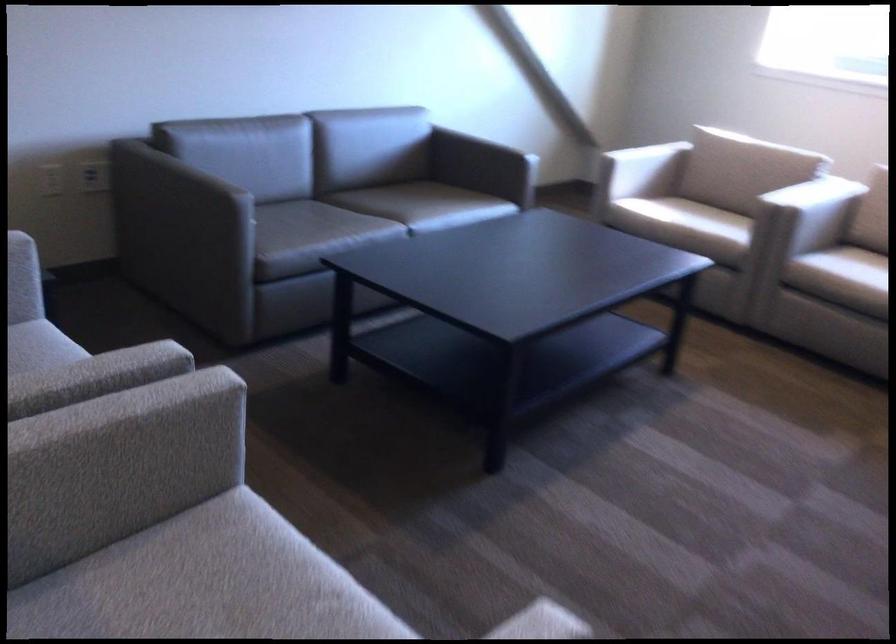
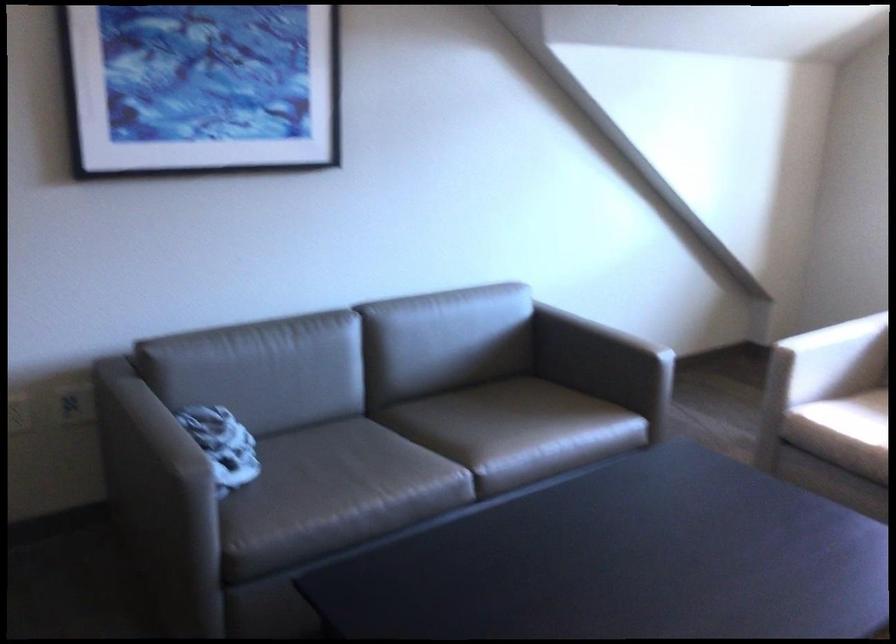
Question: In a continuous first-person perspective shot, in which direction is the camera moving?

Choices:
 (A) Left
 (B) Right
 (C) Forward
 (D) Backward

Answer: (C)